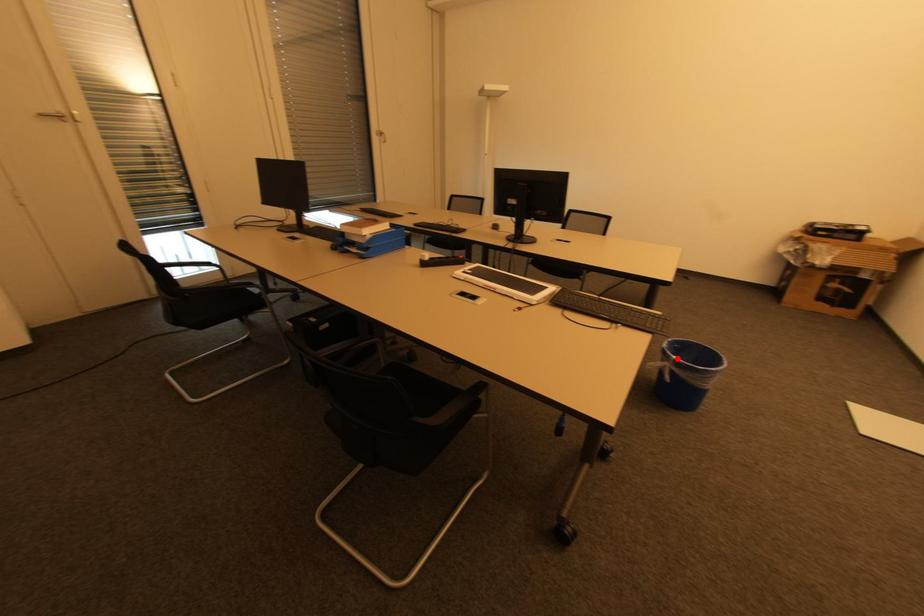
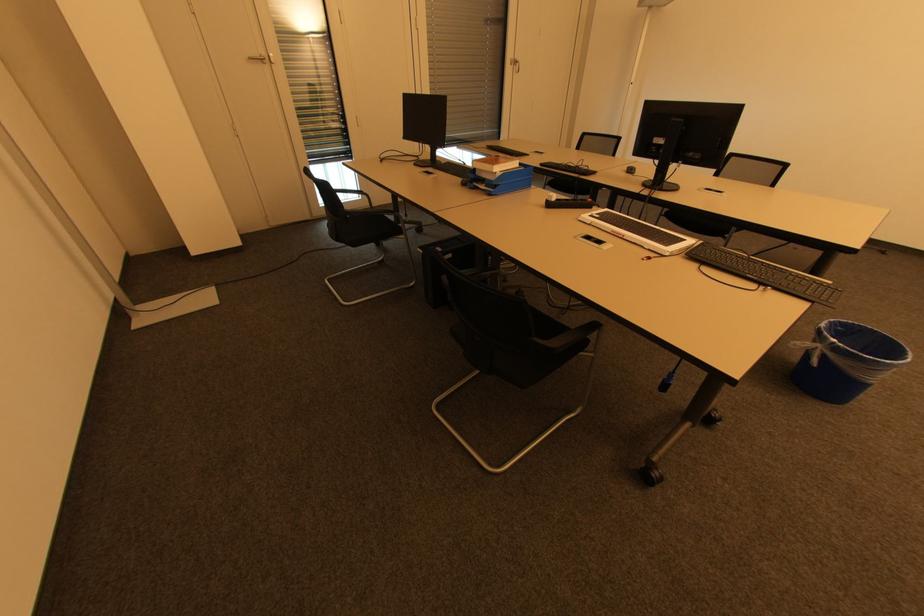
In the second image, find the point that corresponds to the highlighted location in the first image.

(835, 341)